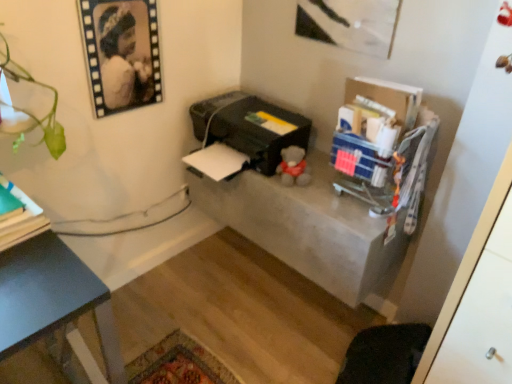
Identify the location of concrete table at center. (310, 229).

In order to click on black matte portrait at upper left in this screenshot , I will do `click(123, 59)`.

The width and height of the screenshot is (512, 384). What do you see at coordinates (247, 128) in the screenshot?
I see `black plastic printer at center` at bounding box center [247, 128].

In order to face black plastic printer at center, should I rotate leftwards or rightwards?

Rotate left and turn 2.390 degrees.

Where is `concrete table at center`? concrete table at center is located at coordinates (310, 229).

Is black plastic printer at center closer to the viewer compared to concrete table at center?

No.

Which is more to the right, black plastic printer at center or concrete table at center?

concrete table at center is more to the right.

In the scene shown: Which of these two, black plastic printer at center or concrete table at center, is bigger?

Bigger between the two is concrete table at center.

From the image's perspective, which object appears higher, black plastic printer at center or concrete table at center?

black plastic printer at center, from the image's perspective.

Identify the location of table that appears below the black matte portrait at upper left (from a real-world perspective). The width and height of the screenshot is (512, 384). (310, 229).

Which object is more forward, black matte portrait at upper left or concrete table at center?

black matte portrait at upper left is more forward.

Can you confirm if black matte portrait at upper left is taller than concrete table at center?

Correct, black matte portrait at upper left is much taller as concrete table at center.

In terms of height, does concrete table at center look taller or shorter compared to black plastic printer at center?

concrete table at center is taller than black plastic printer at center.

From the picture: Which of these two, concrete table at center or black plastic printer at center, is wider?

Wider between the two is black plastic printer at center.

From the image's perspective, is concrete table at center under black plastic printer at center?

Yes.

At what (x,y) coordinates should I click in order to perform the action: click on table to the right of black plastic printer at center. Please return your answer as a coordinate pair (x, y). This screenshot has width=512, height=384. Looking at the image, I should click on point(310,229).

How different are the orientations of black matte portrait at upper left and black plastic printer at center in degrees?

The angular difference between black matte portrait at upper left and black plastic printer at center is 90 degrees.

In the scene shown: Does black matte portrait at upper left have a greater height compared to black plastic printer at center?

Indeed, black matte portrait at upper left has a greater height compared to black plastic printer at center.

Which object is thinner, black matte portrait at upper left or black plastic printer at center?

Thinner between the two is black matte portrait at upper left.

From the image's perspective, which is above, black matte portrait at upper left or black plastic printer at center?

black matte portrait at upper left appears higher in the image.

Relative to green matte book at left, is concrete table at center in front or behind?

Clearly, concrete table at center is behind green matte book at left.

Is green matte book at left at the back of concrete table at center?

concrete table at center is not turned away from green matte book at left.

Is concrete table at center taller or shorter than green matte book at left?

Clearly, concrete table at center is taller compared to green matte book at left.

From the image's perspective, does concrete table at center appear lower than green matte book at left?

Actually, concrete table at center appears above green matte book at left in the image.

Would you say green matte book at left is a long distance from black plastic printer at center?

No, there isn't a large distance between green matte book at left and black plastic printer at center.

Is green matte book at left wider than black plastic printer at center?

Incorrect, the width of green matte book at left does not surpass that of black plastic printer at center.

Is point (20, 216) closer or farther from the camera than point (301, 130)?

Point (20, 216) is closer to the camera than point (301, 130).

Considering the relative sizes of green matte book at left and black plastic printer at center in the image provided, is green matte book at left shorter than black plastic printer at center?

Indeed, green matte book at left has a lesser height compared to black plastic printer at center.

Can you confirm if green matte book at left is taller than black matte portrait at upper left?

No.

From the picture: Can you tell me how much green matte book at left and black matte portrait at upper left differ in facing direction?

The facing directions of green matte book at left and black matte portrait at upper left are 0.00483 degrees apart.

Considering the sizes of objects green matte book at left and black matte portrait at upper left in the image provided, who is bigger, green matte book at left or black matte portrait at upper left?

green matte book at left.

I want to click on book in front of the black matte portrait at upper left, so click(x=21, y=219).

Where is `table lying in front of the black plastic printer at center`? This screenshot has width=512, height=384. table lying in front of the black plastic printer at center is located at coordinates (310, 229).

Where is `table below the black matte portrait at upper left (from the image's perspective)`? table below the black matte portrait at upper left (from the image's perspective) is located at coordinates (310, 229).

Based on their spatial positions, is green matte book at left or black plastic printer at center closer to concrete table at center?

black plastic printer at center lies closer to concrete table at center than the other object.

Looking at the image, which one is located closer to concrete table at center, black plastic printer at center or black matte portrait at upper left?

Among the two, black plastic printer at center is located nearer to concrete table at center.

When comparing their distances from black plastic printer at center, does green matte book at left or black matte portrait at upper left seem further?

green matte book at left is positioned further to the anchor black plastic printer at center.

Looking at the image, which one is located further to green matte book at left, black matte portrait at upper left or black plastic printer at center?

black plastic printer at center lies further to green matte book at left than the other object.

Estimate the real-world distances between objects in this image. Which object is further from concrete table at center, black plastic printer at center or green matte book at left?

The object further to concrete table at center is green matte book at left.

Considering their positions, is concrete table at center positioned further to black plastic printer at center than green matte book at left?

The object further to black plastic printer at center is green matte book at left.

From the image, which object appears to be nearer to green matte book at left, concrete table at center or black plastic printer at center?

Based on the image, black plastic printer at center appears to be nearer to green matte book at left.

From the image, which object appears to be nearer to green matte book at left, black matte portrait at upper left or concrete table at center?

Among the two, black matte portrait at upper left is located nearer to green matte book at left.

Where is `printer located between green matte book at left and concrete table at center in the left-right direction`? The height and width of the screenshot is (384, 512). printer located between green matte book at left and concrete table at center in the left-right direction is located at coordinates (247, 128).

The image size is (512, 384). I want to click on printer situated between black matte portrait at upper left and concrete table at center from left to right, so click(247, 128).

Where is `person located between green matte book at left and concrete table at center in the left-right direction`? This screenshot has height=384, width=512. person located between green matte book at left and concrete table at center in the left-right direction is located at coordinates (123, 59).

Where is `person between green matte book at left and black plastic printer at center from left to right`? The image size is (512, 384). person between green matte book at left and black plastic printer at center from left to right is located at coordinates (123, 59).